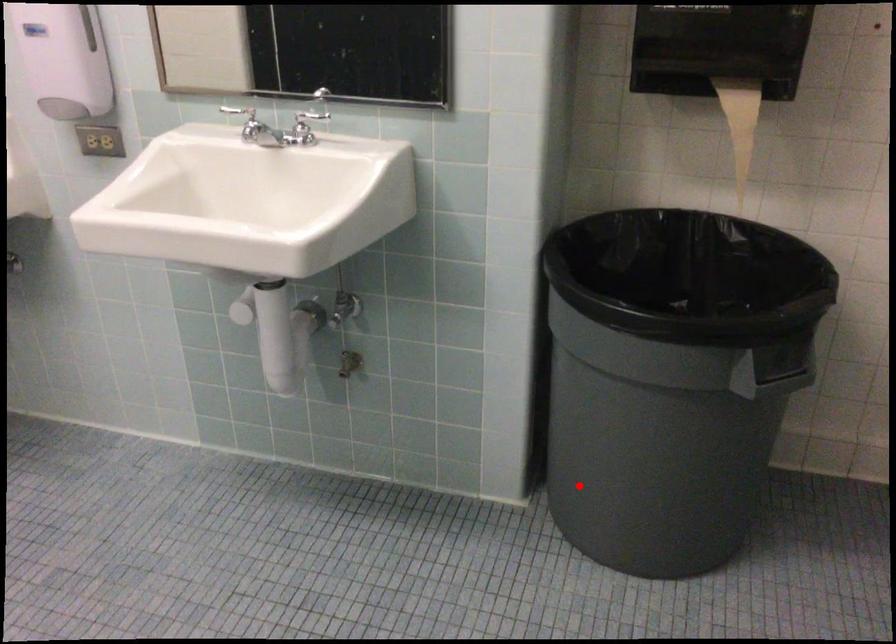
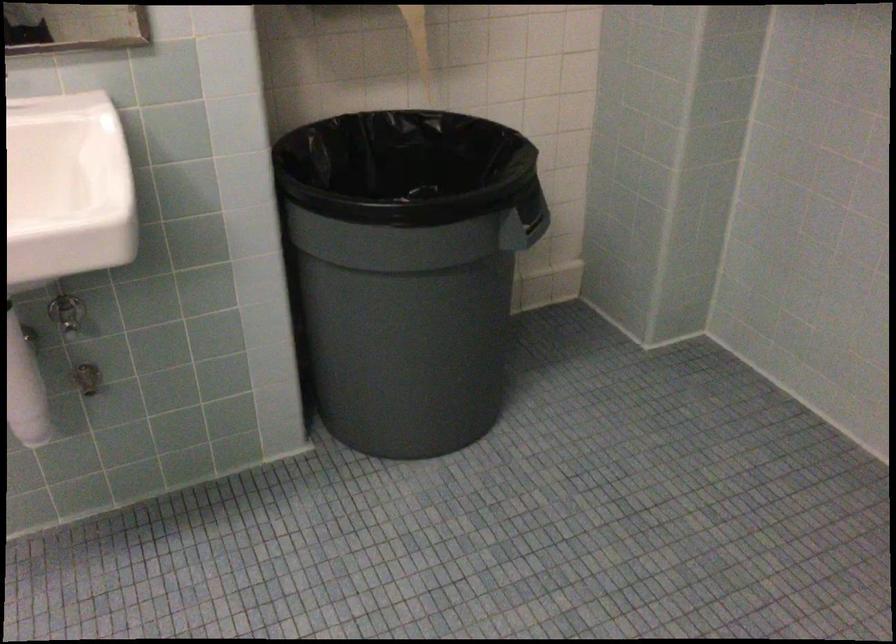
In the second image, find the point that corresponds to the highlighted location in the first image.

(382, 395)